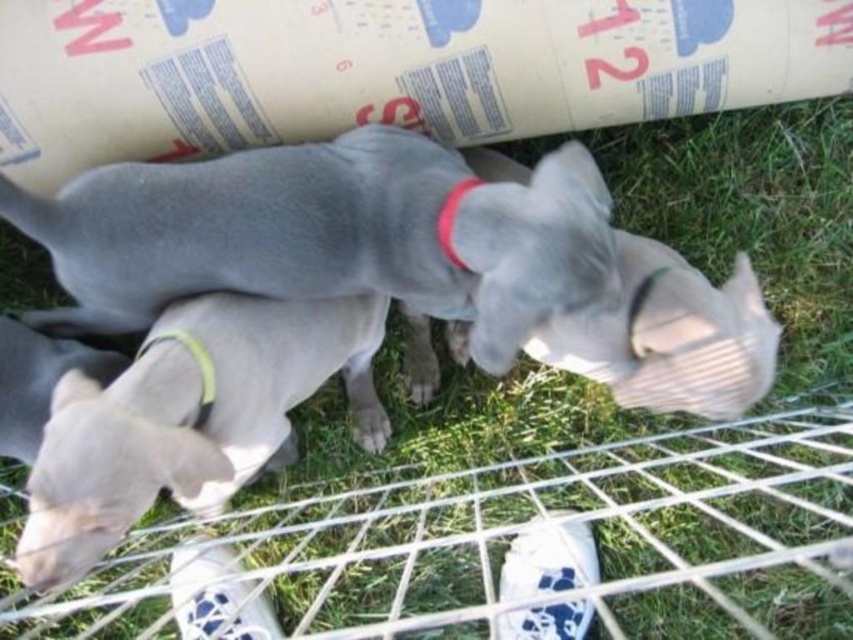
Is smooth gray dog at center wider than red fabric neckband at center?

Indeed, smooth gray dog at center has a greater width compared to red fabric neckband at center.

Who is more distant from viewer, (430, 360) or (469, 179)?

The point (430, 360) is more distant.

Identify the location of smooth gray dog at center. The image size is (853, 640). coord(329,237).

Describe the element at coordinates (190, 419) in the screenshot. This screenshot has height=640, width=853. I see `smooth gray dog at lower left` at that location.

Does point (207, 486) come in front of point (460, 200)?

No, it is not.

Locate an element on the screen. The height and width of the screenshot is (640, 853). smooth gray dog at lower left is located at coordinates (190, 419).

In the scene shown: Between smooth gray dog at lower left and yellow fabric neckband at lower center, which one has more height?

smooth gray dog at lower left

Measure the distance between point (117, 376) and camera.

Point (117, 376) and camera are 4.38 feet apart from each other.

Where is `smooth gray dog at lower left`? The image size is (853, 640). smooth gray dog at lower left is located at coordinates (190, 419).